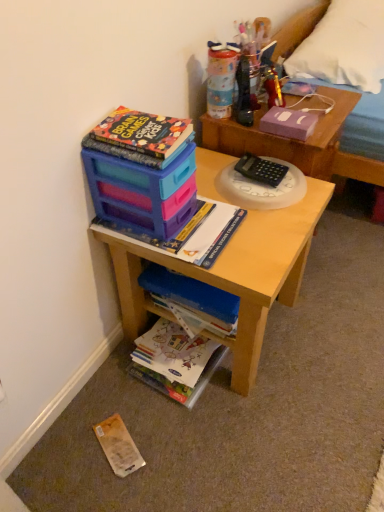
Question: From a real-world perspective, is matte plastic desk at center below wooden bed frame at upper right?

Choices:
 (A) yes
 (B) no

Answer: (A)

Question: Can you confirm if matte plastic desk at center is bigger than wooden bed frame at upper right?

Choices:
 (A) no
 (B) yes

Answer: (A)

Question: Is matte plastic desk at center in front of wooden bed frame at upper right?

Choices:
 (A) yes
 (B) no

Answer: (A)

Question: Is matte plastic desk at center taller than wooden bed frame at upper right?

Choices:
 (A) yes
 (B) no

Answer: (B)

Question: Would you say wooden bed frame at upper right is part of matte plastic desk at center's contents?

Choices:
 (A) no
 (B) yes

Answer: (A)

Question: Could you tell me if matte plastic desk at center is turned towards wooden bed frame at upper right?

Choices:
 (A) yes
 (B) no

Answer: (B)

Question: From the image's perspective, is wooden bed frame at upper right located beneath black plastic calculator at center, the 1th stationery ordered from the bottom?

Choices:
 (A) no
 (B) yes

Answer: (A)

Question: Can you confirm if wooden bed frame at upper right is positioned to the left of black plastic calculator at center, the second stationery when ordered from top to bottom?

Choices:
 (A) yes
 (B) no

Answer: (B)

Question: Does wooden bed frame at upper right have a smaller size compared to black plastic calculator at center, the 1th stationery ordered from the bottom?

Choices:
 (A) no
 (B) yes

Answer: (A)

Question: Is wooden bed frame at upper right positioned far away from black plastic calculator at center, the 1th stationery ordered from the bottom?

Choices:
 (A) yes
 (B) no

Answer: (B)

Question: From the image's perspective, is wooden bed frame at upper right above black plastic calculator at center, the second stationery when ordered from top to bottom?

Choices:
 (A) no
 (B) yes

Answer: (B)

Question: Is wooden bed frame at upper right thinner than black plastic calculator at center, the 1th stationery ordered from the bottom?

Choices:
 (A) no
 (B) yes

Answer: (A)

Question: Does colored paper art at lower center, arranged as the 1th book when ordered from the bottom, have a greater height compared to yellow paper at lower left, the second paperback book when ordered from right to left?

Choices:
 (A) yes
 (B) no

Answer: (A)